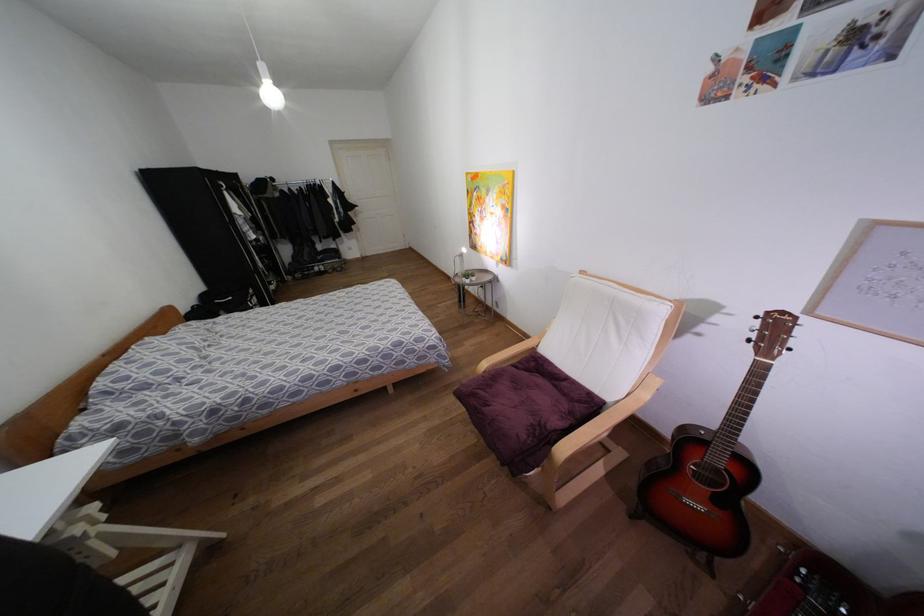
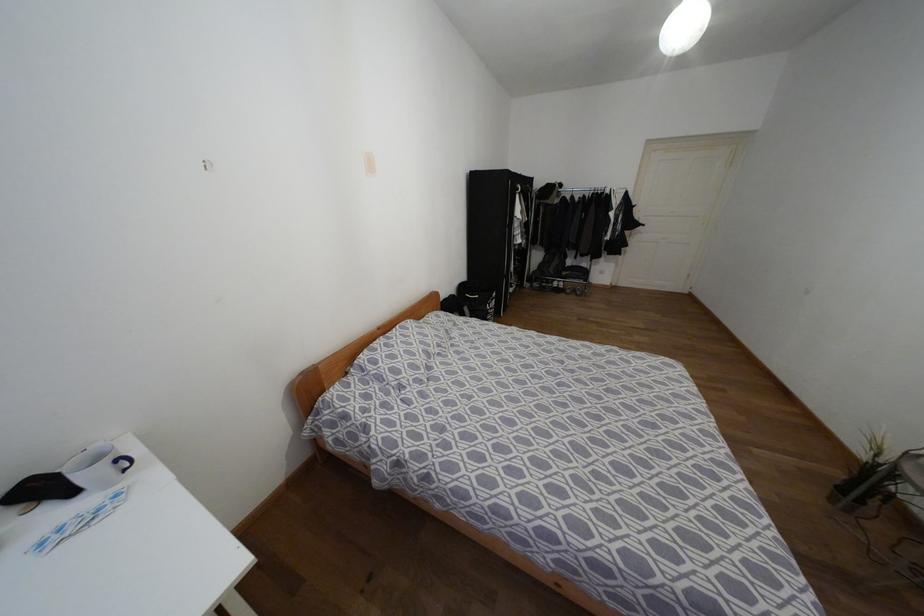
Locate, in the second image, the point that corresponds to [250,291] in the first image.

(493, 294)